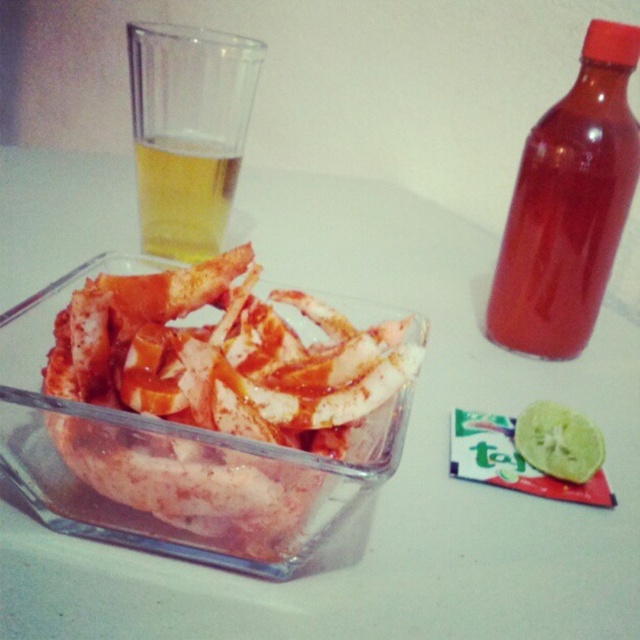
You are a delivery person who just arrived at the location and need to place a new transparent plastic bottle at upper right on the table. The table is 1 meter away from you. Can you place it without moving any existing items on the table?

The distance of transparent plastic bottle at upper right from viewer is 27.30 centimeters, which means it is already within the 1 meter distance of the table. Since the bottle is already placed, there is no need to move existing items.

You are a bartender preparing a drink and need to choose between the transparent plastic bottle at upper right and the green textured lime at lower right. Which one is taller?

The transparent plastic bottle at upper right is much taller than the green textured lime at lower right.

You are a waiter at a restaurant and you see the translucent plastic cup at upper left and the translucent glass at upper left on the same table. Which one is placed above the other?

The translucent plastic cup at upper left is positioned over the translucent glass at upper left, so it is placed above the glass.